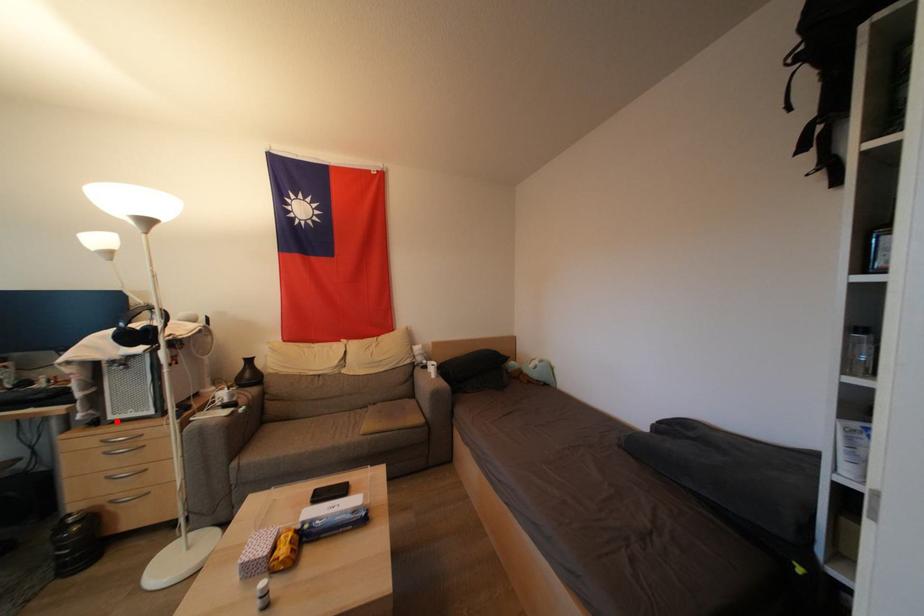
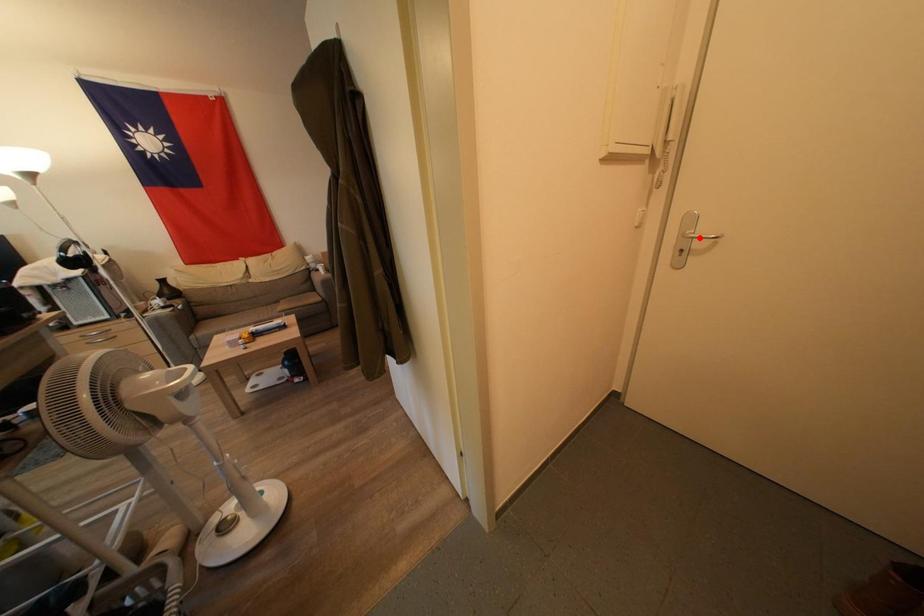
I am providing you with two images of the same scene from different viewpoints. A red point is marked on the first image and another point is marked on the second image. Does the point marked in image1 correspond to the same location as the one in image2?

No